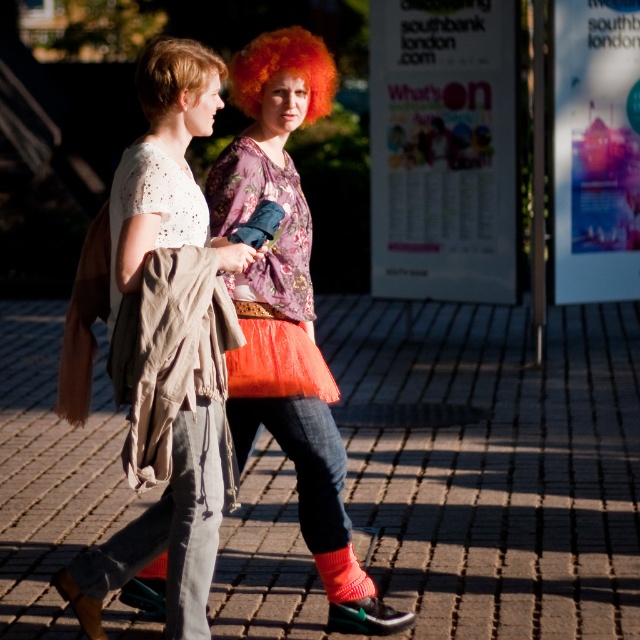
The height and width of the screenshot is (640, 640). Identify the location of matte beige scarf at center. (147, 202).

Which is behind, point (205, 328) or point (339, 577)?

The point (339, 577) is more distant.

Find the location of a particular element. This screenshot has width=640, height=640. matte beige scarf at center is located at coordinates (147, 202).

Can you confirm if brick pavement at center is positioned to the right of orange curly wig at upper center?

No, brick pavement at center is not to the right of orange curly wig at upper center.

Which is more to the left, brick pavement at center or orange curly wig at upper center?

brick pavement at center is more to the left.

Image resolution: width=640 pixels, height=640 pixels. Describe the element at coordinates (492, 461) in the screenshot. I see `brick pavement at center` at that location.

Where is `brick pavement at center`? This screenshot has height=640, width=640. brick pavement at center is located at coordinates (492, 461).

Who is taller, orange tulle skirt at center or short blonde hair at upper left?

With more height is orange tulle skirt at center.

Identify the location of orange tulle skirt at center. (280, 276).